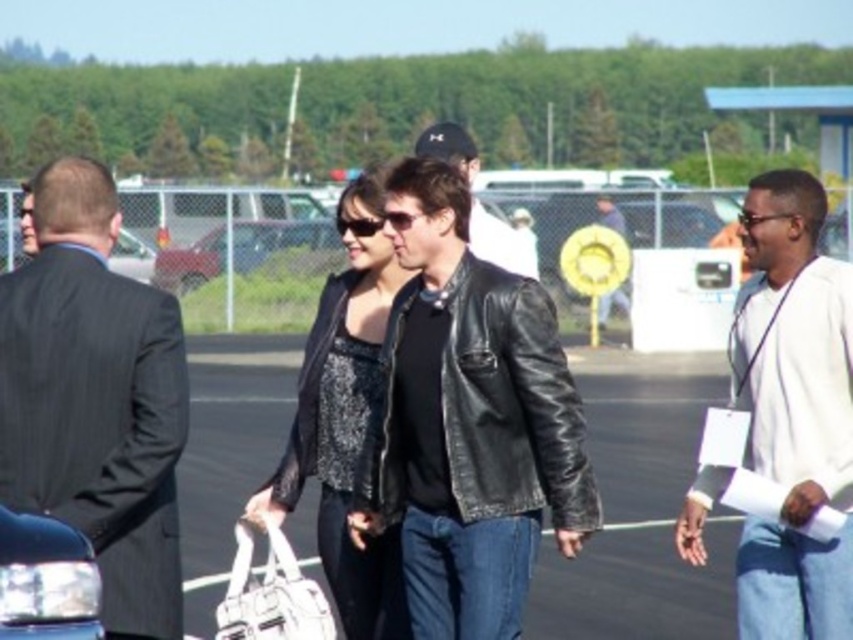
Looking at this image, you are a photographer trying to capture the sparkly black dress at center and the leather jacket at center in the same frame. Based on their positions, which one should you adjust your camera angle to focus on first to ensure both are in the shot?

The sparkly black dress at center is to the left of the leather jacket at center, so you should focus on the leather jacket at center first to ensure both are captured in the frame.

You are a photographer trying to capture a group photo of the dark gray pinstripe suit at left and the sparkly black dress at center. Since you want to ensure both subjects are in focus, you need to know which one is narrower. Which one is thinner?

The dark gray pinstripe suit at left is thinner than the sparkly black dress at center, so you should focus on the thinner one first to ensure clarity.